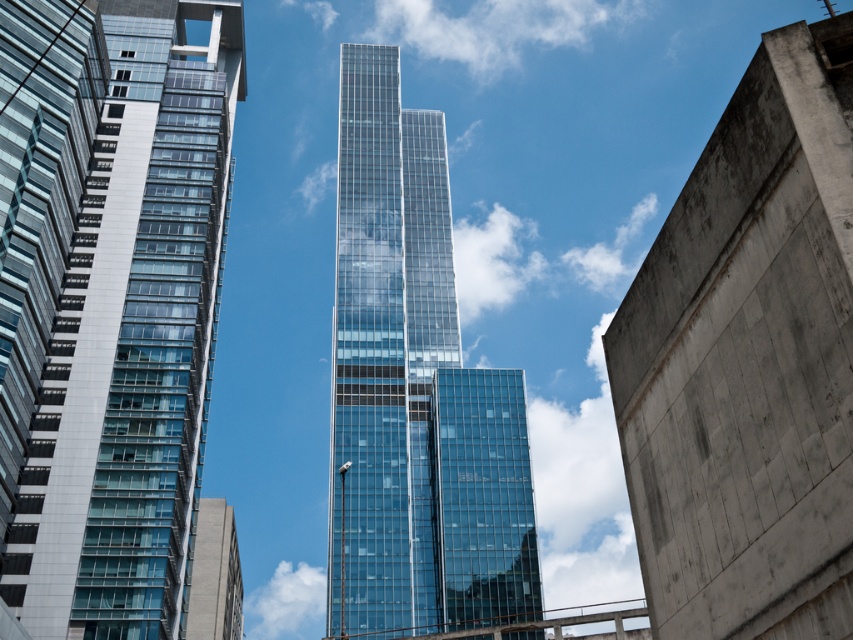
You are an architect planning to install a large sculpture between the smooth concrete wall at right and the gray concrete building at lower left. Given their sizes, which object should the sculpture be placed closer to for balance?

The smooth concrete wall at right is smaller than the gray concrete building at lower left, so the sculpture should be placed closer to the gray concrete building at lower left to achieve balance.

You are standing in the city square looking at the two skyscrapers. You notice two points marked on the buildings. The first point is at coordinates point (378, 589) and the second is at point (190, 632). Which point is closer to you?

Point (378, 589) is in front of point (190, 632), so the first point is closer to you.

You are an architect analyzing the urban layout. Based on the scene, which object is shorter in height between the smooth concrete wall at right and the gray concrete building at lower left?

The smooth concrete wall at right is not as tall as the gray concrete building at lower left, so the smooth concrete wall at right is shorter in height.